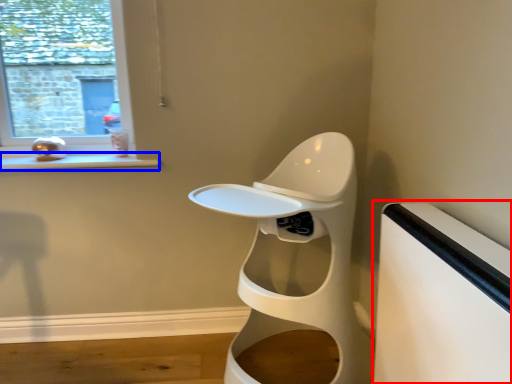
Question: Which object is further to the camera taking this photo, table (highlighted by a red box) or window sill (highlighted by a blue box)?

Choices:
 (A) table
 (B) window sill

Answer: (B)